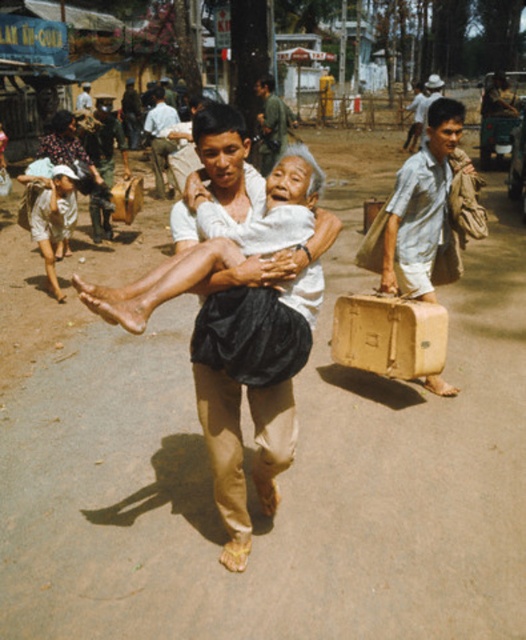
Is beige fabric suitcase at center bigger than light blue shirt at center?

No.

Image resolution: width=526 pixels, height=640 pixels. Identify the location of beige fabric suitcase at center. (420, 208).

Which is in front, point (393, 266) or point (163, 176)?

Positioned in front is point (393, 266).

The height and width of the screenshot is (640, 526). What are the coordinates of `beige fabric suitcase at center` in the screenshot? It's located at (420, 208).

Does point (436, 164) lie in front of point (286, 124)?

That is True.

Between point (401, 234) and point (276, 104), which one is positioned in front?

Point (401, 234)

This screenshot has height=640, width=526. Identify the location of beige fabric suitcase at center. (420, 208).

Who is lower down, khaki pants at center or beige fabric suitcase at center?

khaki pants at center is lower down.

Is the position of khaki pants at center less distant than that of beige fabric suitcase at center?

Yes.

Which is in front, point (272, 472) or point (426, 300)?

Point (272, 472) is in front.

Locate an element on the screen. The width and height of the screenshot is (526, 640). khaki pants at center is located at coordinates (285, 243).